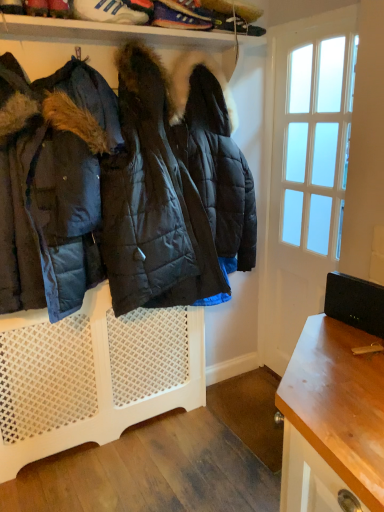
Question: Is shiny leather sneaker at upper left in front of or behind white suede sneakers at upper center, which is the 1th footwear in left-to-right order, in the image?

Choices:
 (A) behind
 (B) front

Answer: (B)

Question: Is point (51, 0) positioned closer to the camera than point (74, 5)?

Choices:
 (A) farther
 (B) closer

Answer: (B)

Question: Considering the real-world distances, which object is closest to the matte black jacket at left?

Choices:
 (A) shiny leather sneaker at upper left
 (B) white mesh radiator at center
 (C) blue suede sneakers at upper center, which appears as the second footwear when viewed from the left
 (D) white suede sneakers at upper center, which is the 1th footwear in left-to-right order

Answer: (B)

Question: Considering the real-world distances, which object is farthest from the white mesh radiator at center?

Choices:
 (A) matte black jacket at left
 (B) shiny leather sneaker at upper left
 (C) white suede sneakers at upper center, arranged as the 2th footwear when viewed from the right
 (D) blue suede sneakers at upper center, the 1th footwear when ordered from right to left

Answer: (D)